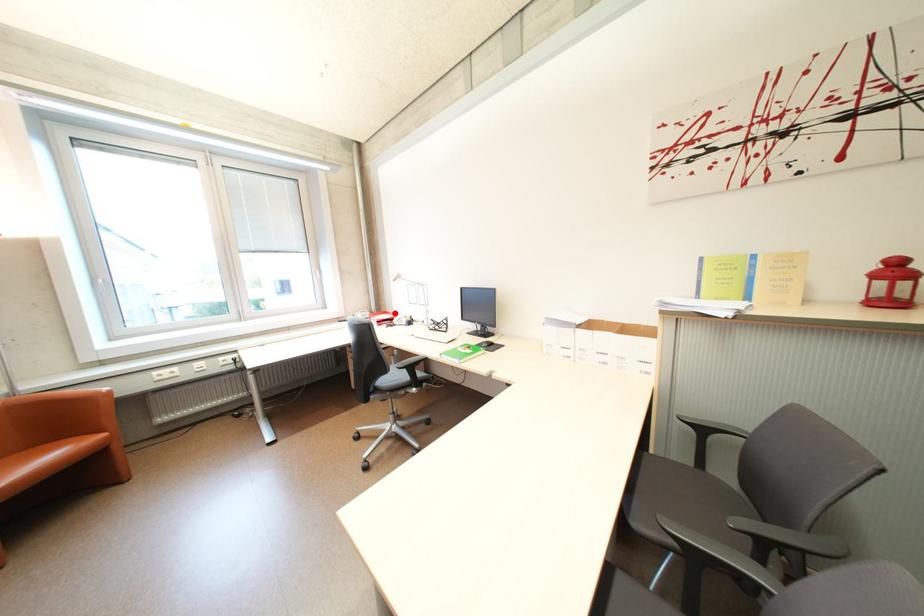
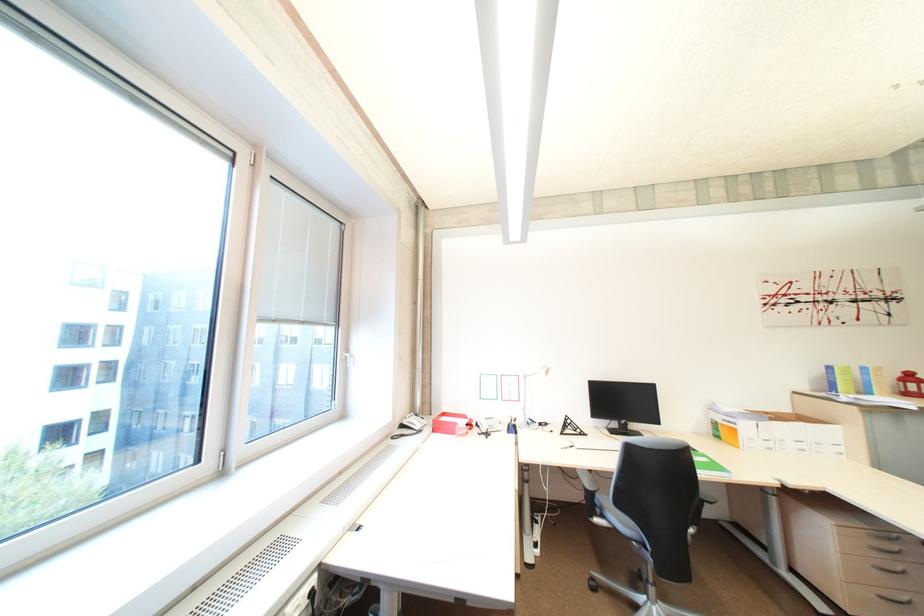
The point at the highlighted location is marked in the first image. Where is the corresponding point in the second image?

(454, 415)